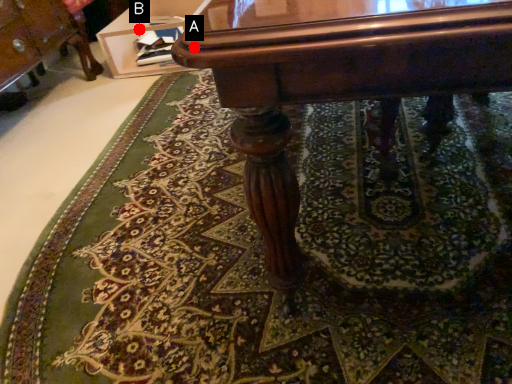
Question: Two points are circled on the image, labeled by A and B beside each circle. Which of the following is the farthest from the observer?

Choices:
 (A) A is further
 (B) B is further

Answer: (B)